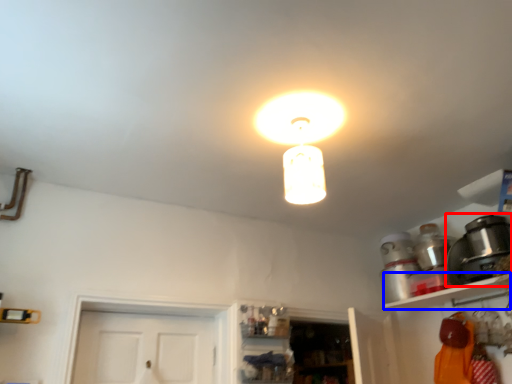
Question: Which of the following is the closest to the observer, appliance (highlighted by a red box) or shelf (highlighted by a blue box)?

Choices:
 (A) appliance
 (B) shelf

Answer: (B)